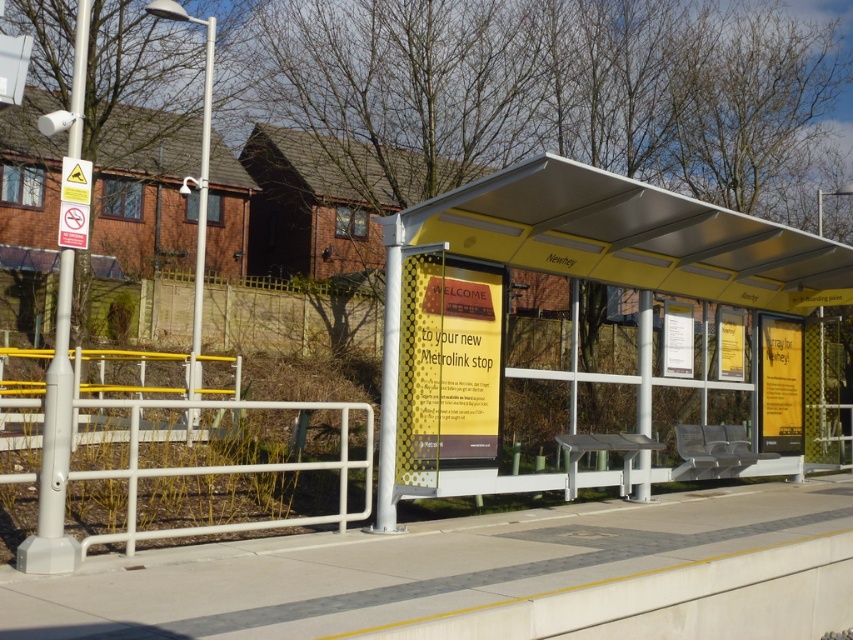
Who is positioned more to the left, metallic yellow canopy at center or brick wall at left?

Positioned to the left is brick wall at left.

Which is in front, point (784, 273) or point (291, 321)?

Point (784, 273)

Locate an element on the screen. The width and height of the screenshot is (853, 640). metallic yellow canopy at center is located at coordinates (625, 236).

Is smooth concrete pavement at center taller than metallic yellow canopy at center?

Incorrect, smooth concrete pavement at center's height is not larger of metallic yellow canopy at center's.

What do you see at coordinates (485, 577) in the screenshot? I see `smooth concrete pavement at center` at bounding box center [485, 577].

This screenshot has height=640, width=853. What are the coordinates of `smooth concrete pavement at center` in the screenshot? It's located at (485, 577).

Does smooth concrete pavement at center have a greater height compared to brick wall at left?

No, smooth concrete pavement at center is not taller than brick wall at left.

Which of these two, smooth concrete pavement at center or brick wall at left, stands taller?

With more height is brick wall at left.

Find the location of `smooth concrete pavement at center`. smooth concrete pavement at center is located at coordinates (485, 577).

I want to click on smooth concrete pavement at center, so coord(485,577).